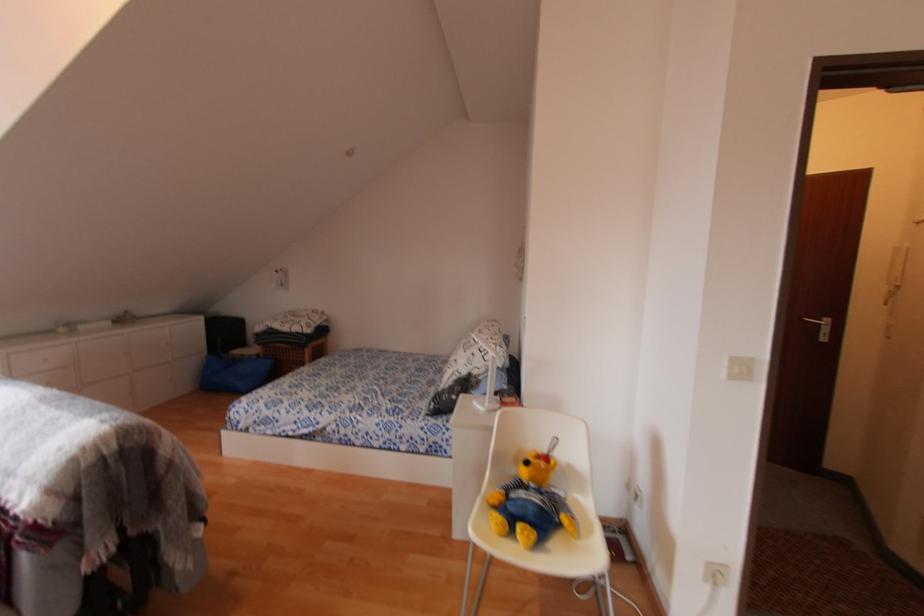
What do you see at coordinates (818, 320) in the screenshot? I see `a silver door handle` at bounding box center [818, 320].